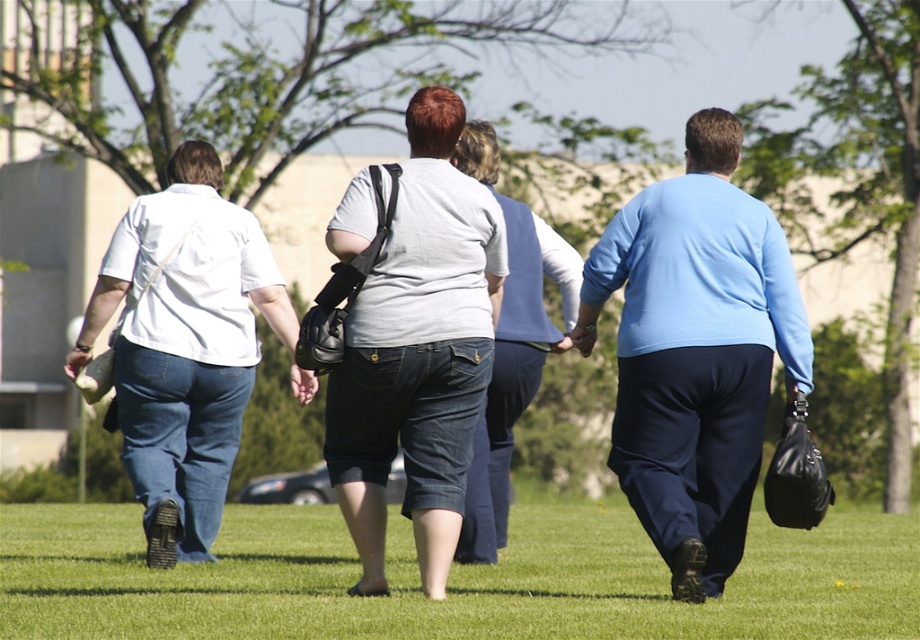
Question: Among these points, which one is nearest to the camera?

Choices:
 (A) (328, 385)
 (B) (457, 496)
 (C) (523, 401)
 (D) (283, 314)

Answer: (B)

Question: Which point is closer to the camera?

Choices:
 (A) (665, 554)
 (B) (444, 403)

Answer: (B)

Question: Can you confirm if light blue fabric shirt at center is positioned below denim shorts at center?

Choices:
 (A) no
 (B) yes

Answer: (B)

Question: Is matte gray shirt at center behind denim shorts at center?

Choices:
 (A) no
 (B) yes

Answer: (A)

Question: Which of the following is the farthest from the observer?

Choices:
 (A) light blue fabric shirt at center
 (B) denim jeans at left

Answer: (B)

Question: Does matte gray shirt at center come in front of denim shorts at center?

Choices:
 (A) yes
 (B) no

Answer: (A)